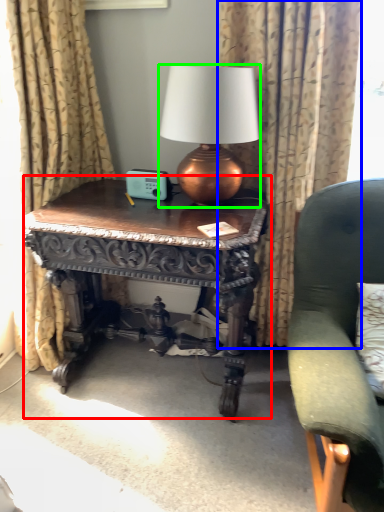
Question: Which is nearer to the table (highlighted by a red box)? curtain (highlighted by a blue box) or lamp (highlighted by a green box).

Choices:
 (A) curtain
 (B) lamp

Answer: (B)